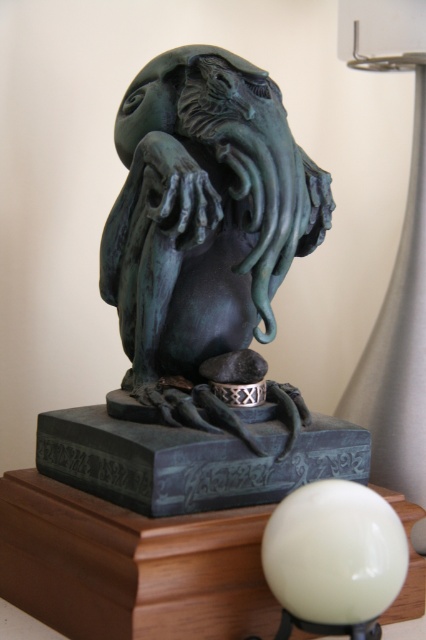
You are an art curator planning to move the green patina sculpture at center to a new location. You want to ensure that the wooden table at lower left remains visible from the front view. Should you move the sculpture forward or backward relative to its current position?

The wooden table at lower left is currently behind the green patina sculpture at center. To keep the wooden table at lower left visible from the front view, you should move the sculpture backward, allowing the table to be seen in front of it.

You are a curator preparing to install a new exhibit. The exhibit requires that all items must be placed at least 36 inches away from visitors to prevent accidental contact. You see the green patina sculpture at center. Can you confirm if the sculpture meets this requirement?

The green patina sculpture at center is currently 33.16 inches away from the viewer, which is less than the required 36 inches. Therefore, it does not meet the exhibit requirement and needs to be moved further away.

You are an artist who wants to place a new small statue on the wooden table at lower left and the white glossy sphere at lower center. Which object should you place it on if you want it closer to the right side of the scene?

The white glossy sphere at lower center is positioned on the right side of the wooden table at lower left. Therefore, placing the statue on the white glossy sphere at lower center will position it closer to the right side of the scene.